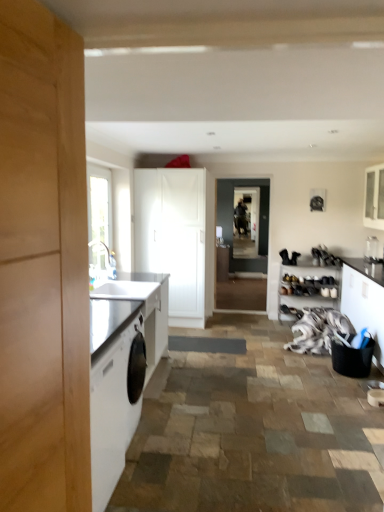
Question: Relative to black fabric basket at right, the second cabinetry viewed from the right, is white matte cabinet at center, the fourth cabinetry positioned from the right, in front or behind?

Choices:
 (A) front
 (B) behind

Answer: (B)

Question: Is white matte cabinet at center, the fourth cabinetry positioned from the right, inside the boundaries of black fabric basket at right, the second cabinetry viewed from the right, or outside?

Choices:
 (A) inside
 (B) outside

Answer: (B)

Question: Based on their relative distances, which object is farther from the white glossy cabinet at upper right, which is the fourth cabinetry from left to right?

Choices:
 (A) black fabric basket at right, the second cabinetry viewed from the right
 (B) clear glass window at left
 (C) clear glass vase at upper right
 (D) white fabric at lower right
 (E) white matte shoe rack at right, which is the 2th cabinetry in left-to-right order

Answer: (B)

Question: Which object is the closest to the dark gray matte screen door at center, marked as the first screen door in a front-to-back arrangement?

Choices:
 (A) clear glass window at left
 (B) clear glass vase at upper right
 (C) black fabric basket at right, the second cabinetry viewed from the right
 (D) white matte cabinet at center, which is counted as the 1th cabinetry, starting from the left
 (E) white matte shoe rack at right, which is the 2th cabinetry in left-to-right order

Answer: (E)